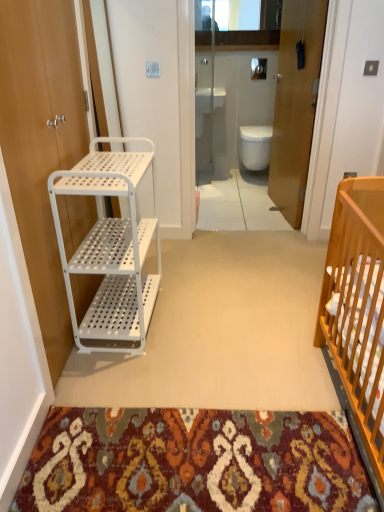
Question: From their relative heights in the image, would you say white glossy sink at upper center is taller or shorter than transparent glass door at center?

Choices:
 (A) tall
 (B) short

Answer: (B)

Question: From the image's perspective, is white glossy sink at upper center positioned above or below transparent glass door at center?

Choices:
 (A) above
 (B) below

Answer: (A)

Question: Which object is the farthest from the wooden door at center, acting as the second door starting from the front?

Choices:
 (A) white glossy sink at upper center
 (B) transparent glass door at center
 (C) white glossy toilet at center
 (D) white perforated shelving unit at left
 (E) white matte door at left, the 2th door from the right

Answer: (E)

Question: Which object is positioned farthest from the white glossy toilet at center?

Choices:
 (A) transparent glass door at center
 (B) wooden door at center, acting as the second door starting from the front
 (C) white matte door at left, the 1th door positioned from the left
 (D) white glossy sink at upper center
 (E) white perforated shelving unit at left

Answer: (C)